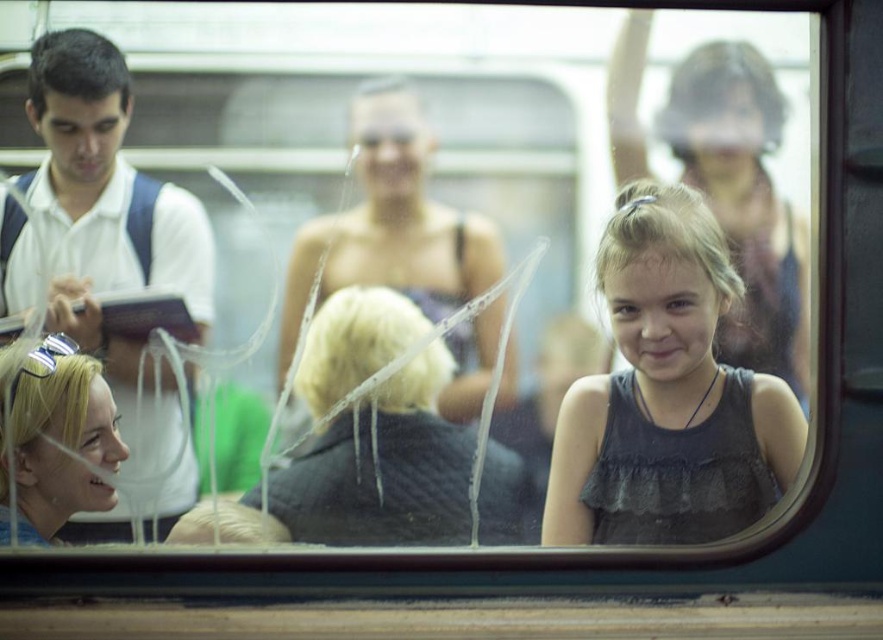
Question: Which point is farther from the camera taking this photo?

Choices:
 (A) (88, 237)
 (B) (449, 276)

Answer: (B)

Question: Among these points, which one is nearest to the camera?

Choices:
 (A) (327, 372)
 (B) (308, 252)
 (C) (19, 499)

Answer: (C)

Question: Is matte gray dress at center closer to camera compared to matte black dress at upper right?

Choices:
 (A) yes
 (B) no

Answer: (B)

Question: Considering the relative positions of dark gray textured sweater at center and blonde hair at lower left in the image provided, where is dark gray textured sweater at center located with respect to blonde hair at lower left?

Choices:
 (A) right
 (B) left

Answer: (A)

Question: Where is white shirt at left located in relation to blonde hair at lower left in the image?

Choices:
 (A) right
 (B) left

Answer: (A)

Question: Which object is positioned farthest from the dark gray textured sweater at center?

Choices:
 (A) matte gray dress at center
 (B) white shirt at left
 (C) blonde hair at lower left
 (D) matte black tank top at center

Answer: (C)